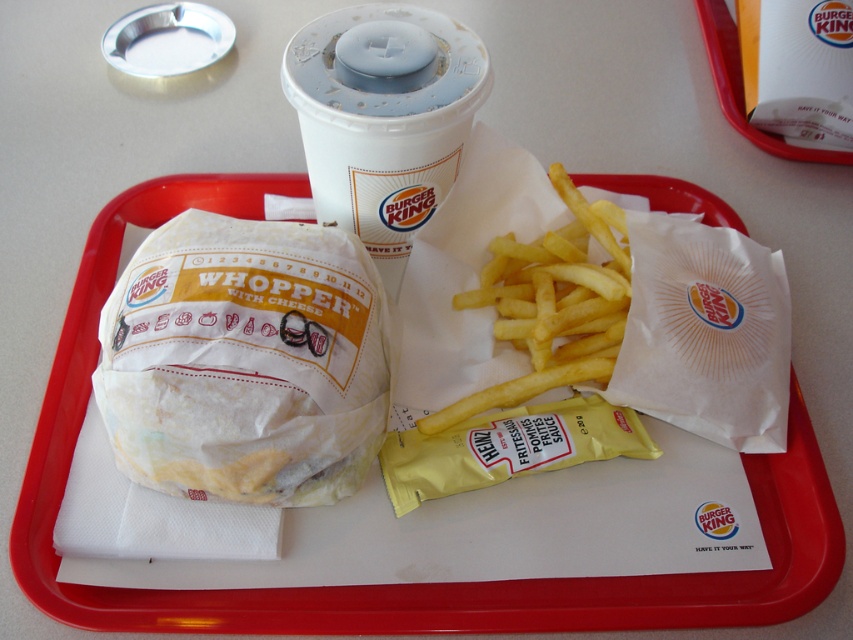
You are a customer at Burger King who wants to grab your drink without touching the fries. Based on the scene, where is the white paper cup at upper center in relation to the golden crispy french fries at center?

The white paper cup at upper center is located above the golden crispy french fries at center, so you can reach it without disturbing the fries.

You are a customer at Burger King who wants to grab the white paper cup at upper center. However, there is a white paper whopper at left in the way. Can you reach the cup without moving the whopper?

The white paper whopper at left is closer to the viewer than the white paper cup at upper center, so you cannot reach the cup without moving the whopper.